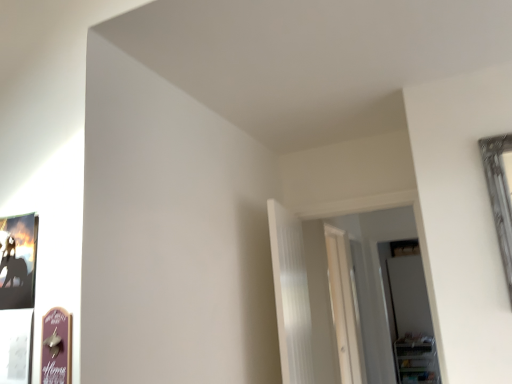
Question: Would you say transparent glass door at right, the second glass door when ordered from front to back, is a long distance from transparent glass door at center, which is the 1th glass door from front to back?

Choices:
 (A) yes
 (B) no

Answer: (A)

Question: From a real-world perspective, does transparent glass door at right, which is the 1th glass door from right to left, stand above transparent glass door at center, which appears as the second glass door when viewed from the right?

Choices:
 (A) no
 (B) yes

Answer: (A)

Question: Is transparent glass door at right, which is the 1th glass door from right to left, positioned before transparent glass door at center, which appears as the second glass door when viewed from the right?

Choices:
 (A) no
 (B) yes

Answer: (A)

Question: From the image's perspective, is transparent glass door at right, the 1th glass door from the back, under transparent glass door at center, which is counted as the 1th glass door, starting from the left?

Choices:
 (A) no
 (B) yes

Answer: (B)

Question: Can transparent glass door at center, which is counted as the 1th glass door, starting from the left, be found inside transparent glass door at right, which is the 1th glass door from right to left?

Choices:
 (A) no
 (B) yes

Answer: (A)

Question: In terms of size, does wooden sign at lower left appear bigger or smaller than white ribbed curtain at center?

Choices:
 (A) big
 (B) small

Answer: (B)

Question: In the image, is wooden sign at lower left positioned in front of or behind white ribbed curtain at center?

Choices:
 (A) front
 (B) behind

Answer: (A)

Question: Considering the relative positions of wooden sign at lower left and white ribbed curtain at center in the image provided, is wooden sign at lower left to the left or to the right of white ribbed curtain at center?

Choices:
 (A) left
 (B) right

Answer: (A)

Question: Is wooden sign at lower left inside or outside of white ribbed curtain at center?

Choices:
 (A) inside
 (B) outside

Answer: (B)

Question: Is transparent glass door at center, which is counted as the 1th glass door, starting from the left, to the left or to the right of wooden sign at lower left in the image?

Choices:
 (A) left
 (B) right

Answer: (B)

Question: From the image's perspective, is transparent glass door at center, which appears as the second glass door when viewed from the right, located above or below wooden sign at lower left?

Choices:
 (A) above
 (B) below

Answer: (B)

Question: Relative to wooden sign at lower left, is transparent glass door at center, which ranks as the 2th glass door in back-to-front order, in front or behind?

Choices:
 (A) front
 (B) behind

Answer: (B)

Question: Is transparent glass door at center, which appears as the second glass door when viewed from the right, bigger or smaller than wooden sign at lower left?

Choices:
 (A) big
 (B) small

Answer: (A)

Question: Visually, is white ribbed curtain at center positioned to the left or to the right of transparent glass door at right, the second glass door when ordered from front to back?

Choices:
 (A) right
 (B) left

Answer: (B)

Question: From their relative heights in the image, would you say white ribbed curtain at center is taller or shorter than transparent glass door at right, which ranks as the 2th glass door in left-to-right order?

Choices:
 (A) short
 (B) tall

Answer: (A)